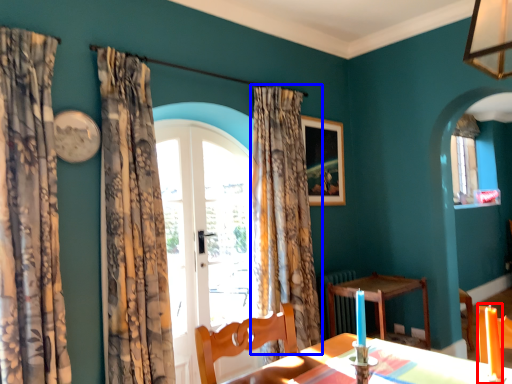
Question: Which object appears closest to the camera in this image, candle (highlighted by a red box) or curtain (highlighted by a blue box)?

Choices:
 (A) candle
 (B) curtain

Answer: (A)